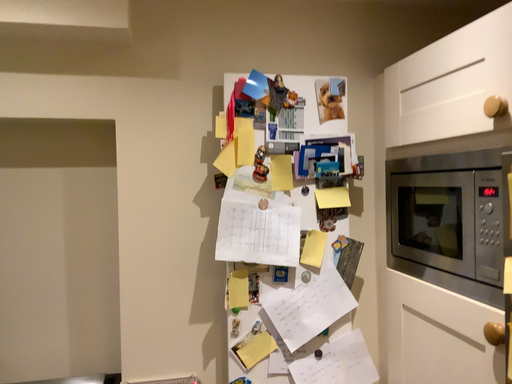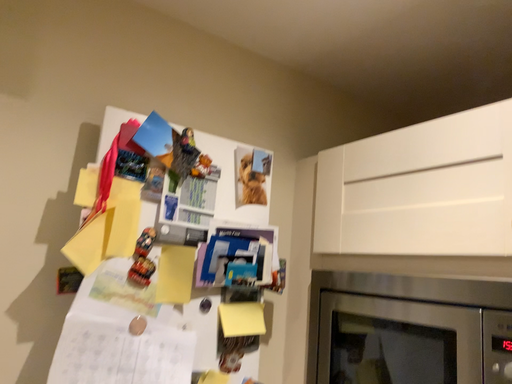
Question: Which way did the camera rotate in the video?

Choices:
 (A) rotated downward
 (B) rotated upward

Answer: (B)